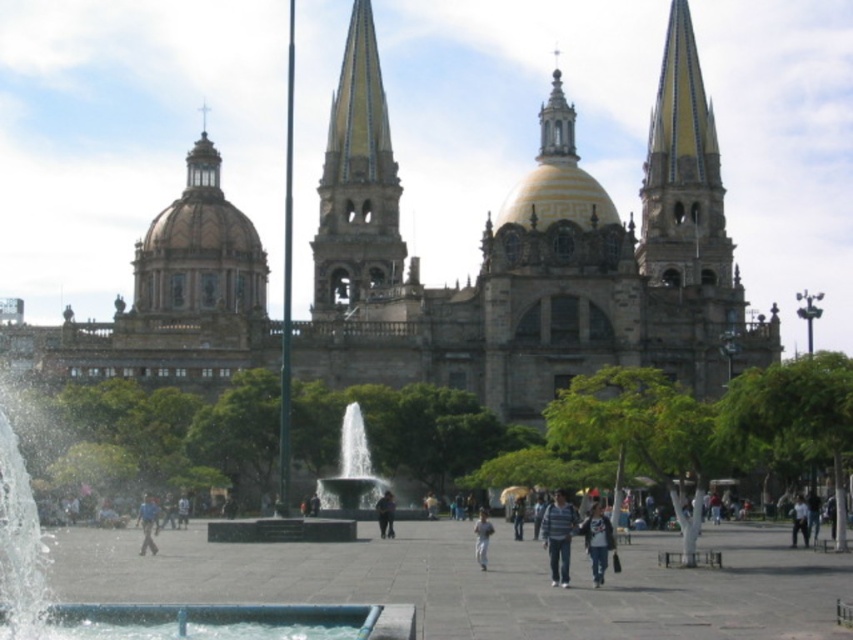
You are standing in the plaza in front of the cathedral and want to take a photo of the smooth stone spire at upper right. The spire is positioned at coordinates approximately 0.272 on the horizontal axis and 0.801 on the vertical axis. If you move 0.1 units to the right along the horizontal axis, will the spire still be fully visible in your photo?

The smooth stone spire at upper right is located at point 0.272 on the horizontal axis. Moving 0.1 units to the right would place you at 0.372 horizontally. Since the spire is part of the cathedral structure and the plaza provides a clear view, it should remain fully visible as you move slightly to the right.

In the scene shown: You are a photographer planning to take a portrait of someone standing in the cathedral plaza. You notice the striped shirt at center and dark blue jeans at center in the scene. Which clothing item should you focus on to ensure the subject is in the foreground of your photo?

The striped shirt at center should be focused on because it is above the dark blue jeans at center, indicating it is closer to the camera and thus part of the foreground.

You are a tourist standing in the plaza in front of the cathedral. You notice the smooth stone spire at upper right and the blue fabric person at lower left. Which object appears larger in the image?

The smooth stone spire at upper right appears larger than the blue fabric person at lower left in the image.